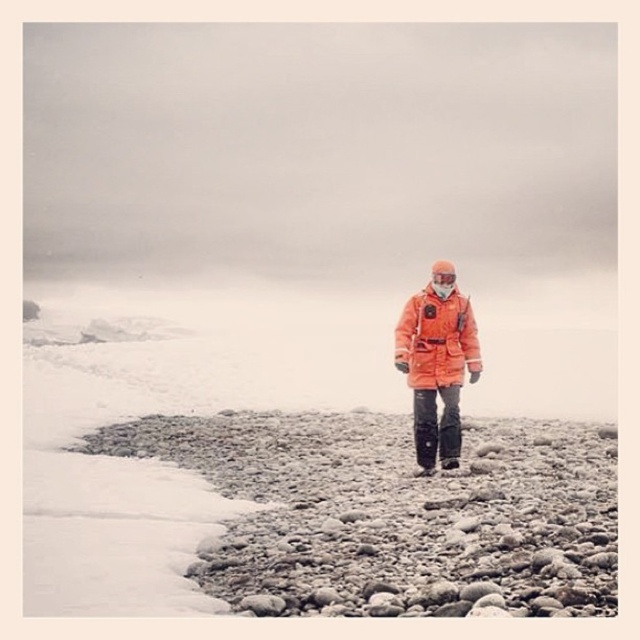
Which is more to the right, white matte snow at center or orange matte jacket at center?

From the viewer's perspective, orange matte jacket at center appears more on the right side.

Does white matte snow at center lie behind orange matte jacket at center?

No, white matte snow at center is in front of orange matte jacket at center.

What do you see at coordinates (170, 413) in the screenshot? I see `white matte snow at center` at bounding box center [170, 413].

Find the location of a particular element. This screenshot has width=640, height=640. white matte snow at center is located at coordinates (170, 413).